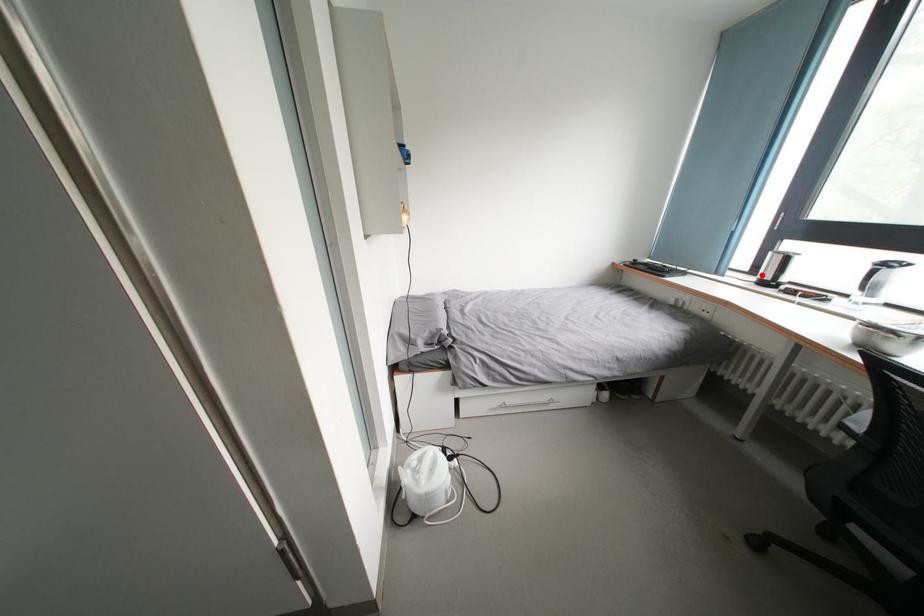
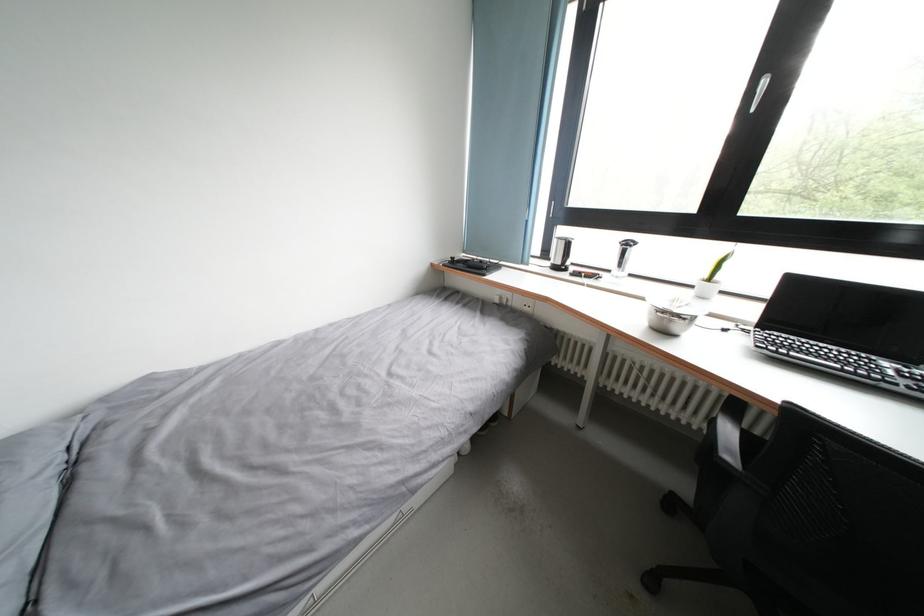
In the second image, find the point that corresponds to the highlighted location in the first image.

(552, 259)